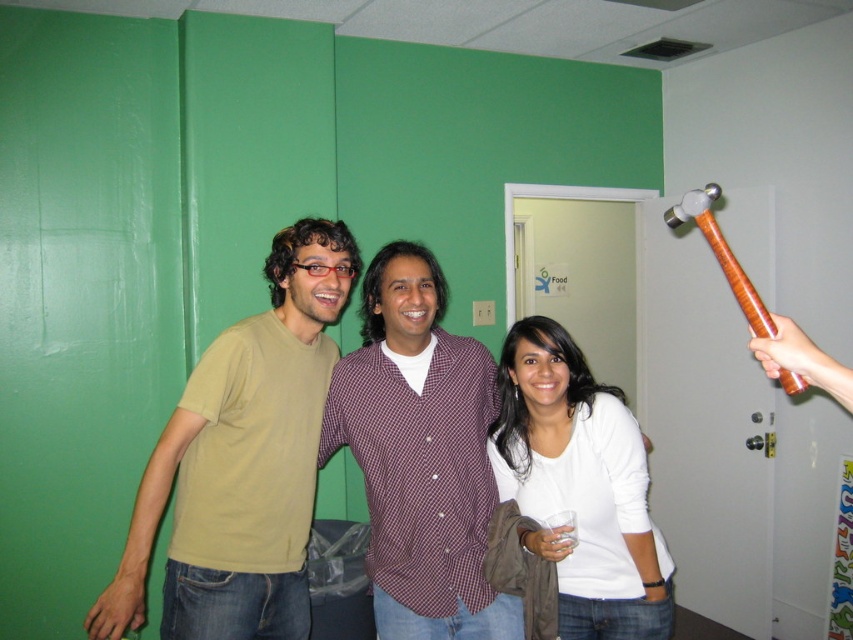
From the picture: Which of these two, maroon checkered shirt at center or wooden hammer at upper right, stands taller?

Standing taller between the two is maroon checkered shirt at center.

Is maroon checkered shirt at center to the left of wooden hammer at upper right from the viewer's perspective?

Indeed, maroon checkered shirt at center is positioned on the left side of wooden hammer at upper right.

Does point (376, 472) lie in front of point (788, 330)?

No.

At what (x,y) coordinates should I click in order to perform the action: click on maroon checkered shirt at center. Please return your answer as a coordinate pair (x, y). Looking at the image, I should click on (421, 454).

Can you confirm if white matte shirt at center is smaller than wooden hammer at upper right?

No.

Which is more to the right, white matte shirt at center or wooden hammer at upper right?

wooden hammer at upper right is more to the right.

Describe the element at coordinates (581, 484) in the screenshot. I see `white matte shirt at center` at that location.

The image size is (853, 640). What are the coordinates of `white matte shirt at center` in the screenshot? It's located at (581, 484).

Who is more distant from viewer, (215, 557) or (564, 440)?

Positioned behind is point (564, 440).

Is matte yellow t-shirt at center taller than white matte shirt at center?

Indeed, matte yellow t-shirt at center has a greater height compared to white matte shirt at center.

Between point (225, 460) and point (508, 442), which one is positioned behind?

The point (508, 442) is more distant.

Locate an element on the screen. The height and width of the screenshot is (640, 853). matte yellow t-shirt at center is located at coordinates (242, 461).